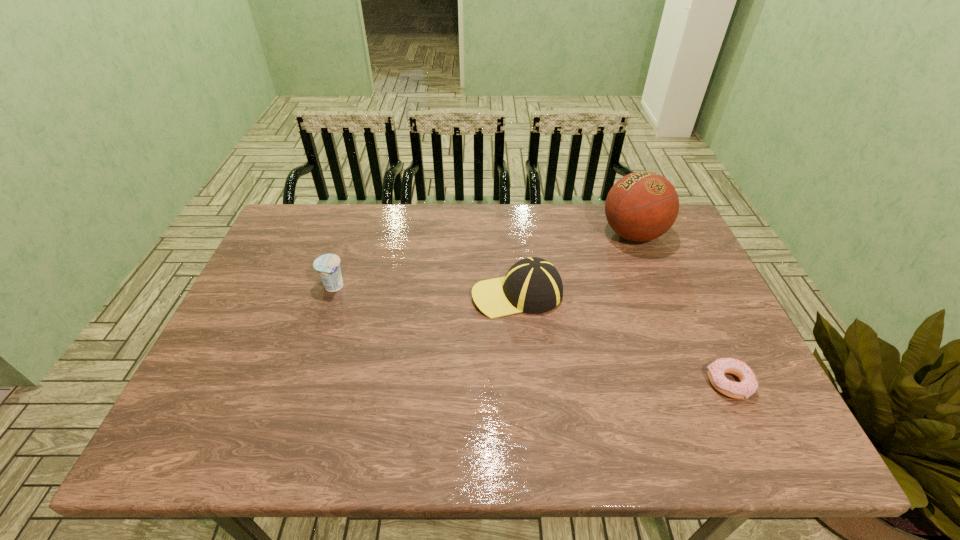
You are a GUI agent. You are given a task and a screenshot of the screen. Output one action in this format:
    pyautogui.click(x=<x>, y=<y>)
    Task: Click on the free space located with the brim of the baseball cap facing forward
    
    Given the screenshot: What is the action you would take?
    pyautogui.click(x=392, y=294)

What are the coordinates of `vacant space located with the brim of the baseball cap facing forward` in the screenshot? It's located at (338, 294).

Find the location of `vacant region located on the back of the third tallest object`. vacant region located on the back of the third tallest object is located at coordinates (357, 219).

This screenshot has width=960, height=540. Identify the location of free location located on the left of the nearest object. (664, 383).

This screenshot has width=960, height=540. Find the location of `object situated at the far edge`. object situated at the far edge is located at coordinates [641, 206].

The height and width of the screenshot is (540, 960). I want to click on basketball positioned at the right edge, so click(641, 206).

Where is `doughnut that is at the right edge`? Image resolution: width=960 pixels, height=540 pixels. doughnut that is at the right edge is located at coordinates (748, 384).

The image size is (960, 540). What are the coordinates of `object present at the far right corner` in the screenshot? It's located at (641, 206).

Locate an element on the screen. This screenshot has width=960, height=540. vacant region at the far edge of the desktop is located at coordinates [x=516, y=205].

Where is `free region at the near edge of the desktop`? The image size is (960, 540). free region at the near edge of the desktop is located at coordinates (709, 442).